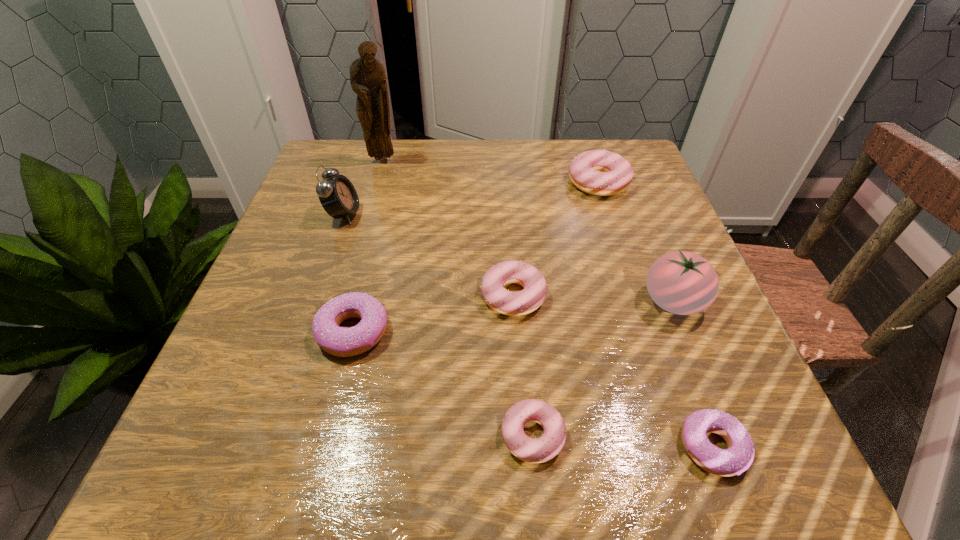
Locate an element on the screen. The width and height of the screenshot is (960, 540). figurine at the far edge is located at coordinates (368, 80).

The image size is (960, 540). Identify the location of doughnut that is at the far edge. (598, 172).

At what (x,y) coordinates should I click in order to perform the action: click on figurine present at the left edge. Please return your answer as a coordinate pair (x, y). Image resolution: width=960 pixels, height=540 pixels. Looking at the image, I should click on (368, 80).

Identify the location of alarm clock at the left edge. Image resolution: width=960 pixels, height=540 pixels. (337, 195).

At what (x,y) coordinates should I click in order to perform the action: click on doughnut that is at the left edge. Please return your answer as a coordinate pair (x, y). The image size is (960, 540). Looking at the image, I should click on (344, 342).

I want to click on tomato present at the right edge, so click(680, 282).

At what (x,y) coordinates should I click in order to perform the action: click on object at the far left corner. Please return your answer as a coordinate pair (x, y). This screenshot has width=960, height=540. Looking at the image, I should click on (368, 80).

At what (x,y) coordinates should I click in order to perform the action: click on object that is at the far right corner. Please return your answer as a coordinate pair (x, y). Image resolution: width=960 pixels, height=540 pixels. Looking at the image, I should click on (598, 172).

Locate an element on the screen. This screenshot has width=960, height=540. object positioned at the near right corner is located at coordinates (739, 456).

You are a GUI agent. You are given a task and a screenshot of the screen. Output one action in this format:
    pyautogui.click(x=<x>, y=<y>)
    Task: Click on the blank area at the far edge
    The width and height of the screenshot is (960, 540).
    Given the screenshot: What is the action you would take?
    pyautogui.click(x=404, y=155)